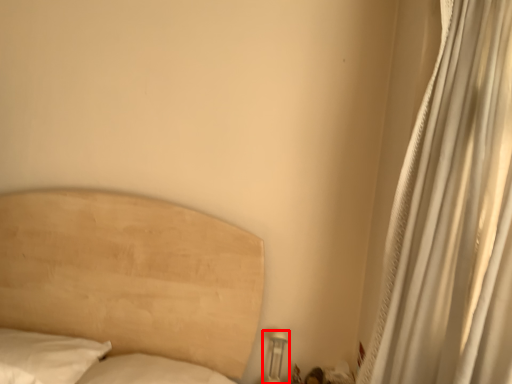
Question: From the image's perspective, where is table lamp (annotated by the red box) located in relation to curtain in the image?

Choices:
 (A) above
 (B) below

Answer: (B)